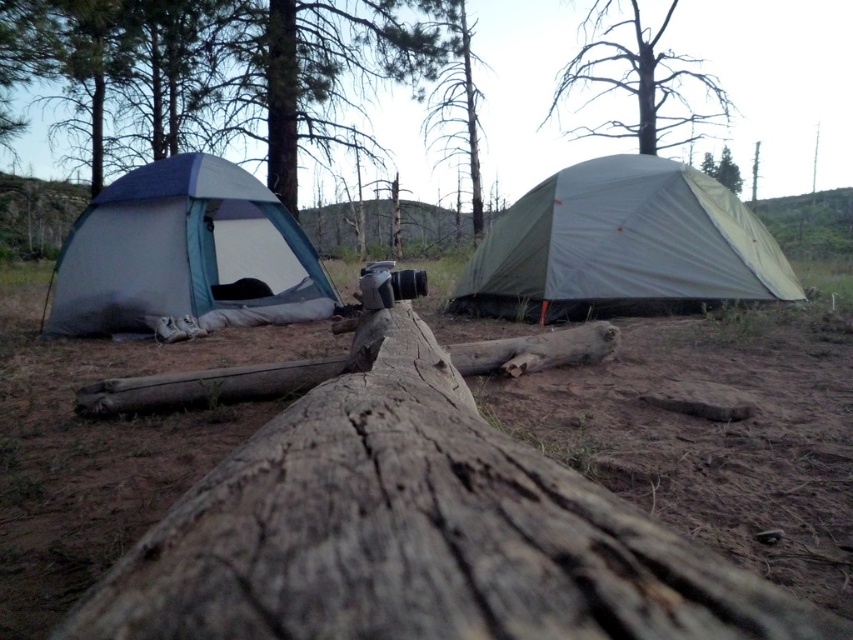
Question: Which point is farther to the camera?

Choices:
 (A) (233, 170)
 (B) (654, 76)
 (C) (403, 577)
 (D) (711, 220)

Answer: (B)

Question: Which object appears closest to the camera in this image?

Choices:
 (A) green fabric tent at center
 (B) smooth bark tree at left
 (C) brown bark tree at upper center
 (D) rough textured log at center

Answer: (D)

Question: Does rough textured log at center appear under smooth bark tree at left?

Choices:
 (A) yes
 (B) no

Answer: (A)

Question: Does rough textured log at center have a greater width compared to green fabric tent at center?

Choices:
 (A) no
 (B) yes

Answer: (A)

Question: Which object is farther from the camera taking this photo?

Choices:
 (A) smooth bark tree at left
 (B) green fabric tent at center
 (C) brown bark tree at upper center
 (D) rough textured log at center

Answer: (C)

Question: Is smooth bark tree at left below matte blue tent at left?

Choices:
 (A) yes
 (B) no

Answer: (B)